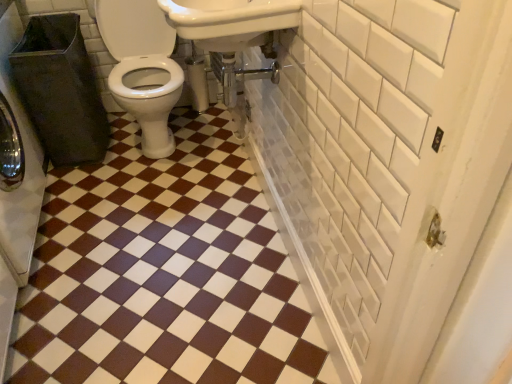
Find the location of a particular element. This screenshot has width=512, height=384. white glossy sink at upper center is located at coordinates (230, 21).

Image resolution: width=512 pixels, height=384 pixels. Describe the element at coordinates (164, 272) in the screenshot. I see `brown glossy tile at center` at that location.

Locate an element on the screen. black plastic trash can at left is located at coordinates (17, 160).

From a real-world perspective, is white glossy sink at upper center on black plastic trash can at left?

Yes, from a real-world perspective, white glossy sink at upper center is on top of black plastic trash can at left.

The height and width of the screenshot is (384, 512). What are the coordinates of `sink above the black plastic trash can at left (from the image's perspective)` in the screenshot? It's located at (230, 21).

Is white glossy sink at upper center looking in the opposite direction of black plastic trash can at left?

No.

From the image's perspective, is white glossy sink at upper center located above black plastic trash can at left?

Yes.

From a real-world perspective, is brown glossy tile at center on white matte toilet paper at center?

Actually, brown glossy tile at center is physically below white matte toilet paper at center in the real world.

Is brown glossy tile at center to the right of white matte toilet paper at center from the viewer's perspective?

Incorrect, brown glossy tile at center is not on the right side of white matte toilet paper at center.

Find the location of a particular element. Image resolution: width=512 pixels, height=384 pixels. ceramic tile on the left of white matte toilet paper at center is located at coordinates (164, 272).

Can you confirm if brown glossy tile at center is thinner than white matte toilet paper at center?

No, brown glossy tile at center is not thinner than white matte toilet paper at center.

Is the depth of white matte toilet paper at center less than that of white glossy sink at upper center?

No, it is behind white glossy sink at upper center.

Between white matte toilet paper at center and white glossy sink at upper center, which one has smaller size?

Smaller between the two is white matte toilet paper at center.

Is white glossy sink at upper center completely or partially inside white matte toilet paper at center?

No, white glossy sink at upper center is not a part of white matte toilet paper at center.

Does white matte toilet paper at center have a greater height compared to white glossy sink at upper center?

Correct, white matte toilet paper at center is much taller as white glossy sink at upper center.

Who is smaller, brown glossy tile at center or black plastic trash can at left?

Smaller between the two is brown glossy tile at center.

From a real-world perspective, who is located higher, brown glossy tile at center or black plastic trash can at left?

black plastic trash can at left, from a real-world perspective.

From the image's perspective, is brown glossy tile at center located above black plastic trash can at left?

No, from the image's perspective, brown glossy tile at center is not on top of black plastic trash can at left.

Is brown glossy tile at center not inside black plastic trash can at left?

Yes.

This screenshot has width=512, height=384. In order to click on ceramic tile located underneath the white glossy sink at upper center (from a real-world perspective) in this screenshot , I will do `click(164, 272)`.

From a real-world perspective, is brown glossy tile at center above or below white glossy sink at upper center?

brown glossy tile at center is situated lower than white glossy sink at upper center in the real world.

Which of these two, brown glossy tile at center or white glossy sink at upper center, stands taller?

With more height is white glossy sink at upper center.

Is brown glossy tile at center oriented towards white glossy sink at upper center?

No, brown glossy tile at center does not turn towards white glossy sink at upper center.

Between point (195, 86) and point (67, 362), which one is positioned behind?

Point (195, 86)

This screenshot has width=512, height=384. Find the location of `ceramic tile located on the left of white matte toilet paper at center`. ceramic tile located on the left of white matte toilet paper at center is located at coordinates (164, 272).

Considering the sizes of objects white matte toilet paper at center and brown glossy tile at center in the image provided, who is bigger, white matte toilet paper at center or brown glossy tile at center?

Bigger between the two is brown glossy tile at center.

Is white matte toilet paper at center far from brown glossy tile at center?

Yes, white matte toilet paper at center and brown glossy tile at center are quite far apart.

From the picture: Is white glossy sink at upper center spatially inside brown glossy tile at center, or outside of it?

white glossy sink at upper center is spatially situated outside brown glossy tile at center.

How different are the orientations of white glossy sink at upper center and brown glossy tile at center in degrees?

90.9 degrees.

Is white glossy sink at upper center with brown glossy tile at center?

No, white glossy sink at upper center is not in contact with brown glossy tile at center.

Is white glossy sink at upper center oriented towards brown glossy tile at center?

No, white glossy sink at upper center is not turned towards brown glossy tile at center.

The width and height of the screenshot is (512, 384). I want to click on sink in front of the black plastic trash can at left, so click(x=230, y=21).

Locate an element on the screen. The image size is (512, 384). ceramic tile on the left of white matte toilet paper at center is located at coordinates (164, 272).

From the image, which object appears to be farther from brown glossy tile at center, black plastic trash can at left or white matte toilet paper at center?

white matte toilet paper at center is further to brown glossy tile at center.

From the image, which object appears to be farther from white matte toilet paper at center, black plastic trash can at left or brown glossy tile at center?

Among the two, brown glossy tile at center is located further to white matte toilet paper at center.

Based on their spatial positions, is white glossy sink at upper center or brown glossy tile at center closer to white matte toilet paper at center?

The object closer to white matte toilet paper at center is white glossy sink at upper center.

From the image, which object appears to be nearer to black plastic trash can at left, white glossy sink at upper center or white matte toilet paper at center?

Among the two, white glossy sink at upper center is located nearer to black plastic trash can at left.

Looking at the image, which one is located further to white matte toilet paper at center, brown glossy tile at center or white glossy sink at upper center?

Based on the image, brown glossy tile at center appears to be further to white matte toilet paper at center.

Which object lies nearer to the anchor point white matte toilet paper at center, black plastic trash can at left or white glossy sink at upper center?

Among the two, white glossy sink at upper center is located nearer to white matte toilet paper at center.

Estimate the real-world distances between objects in this image. Which object is further from white glossy sink at upper center, black plastic trash can at left or white matte toilet paper at center?

Among the two, black plastic trash can at left is located further to white glossy sink at upper center.

From the image, which object appears to be farther from brown glossy tile at center, white matte toilet paper at center or white glossy sink at upper center?

white matte toilet paper at center lies further to brown glossy tile at center than the other object.

Image resolution: width=512 pixels, height=384 pixels. I want to click on washer positioned between brown glossy tile at center and white matte toilet paper at center from near to far, so click(17, 160).

You are a GUI agent. You are given a task and a screenshot of the screen. Output one action in this format:
    pyautogui.click(x=<x>, y=<y>)
    Task: Click on the washer between white glossy sink at upper center and white matte toilet paper at center from front to back
    The height and width of the screenshot is (384, 512).
    Given the screenshot: What is the action you would take?
    pyautogui.click(x=17, y=160)

Where is `ceramic tile between white glossy sink at upper center and white matte toilet paper at center from front to back`? This screenshot has height=384, width=512. ceramic tile between white glossy sink at upper center and white matte toilet paper at center from front to back is located at coordinates (164, 272).

This screenshot has height=384, width=512. In order to click on ceramic tile between black plastic trash can at left and white glossy sink at upper center in this screenshot , I will do `click(164, 272)`.